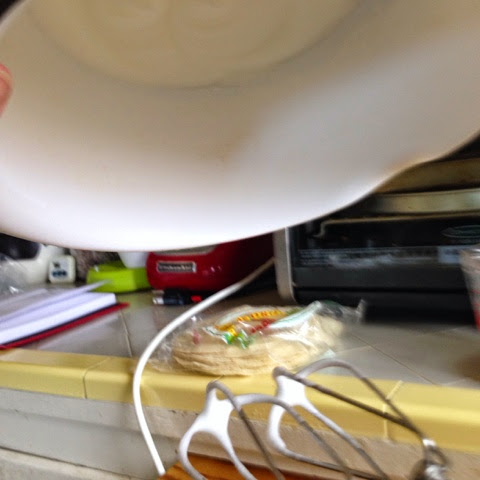
You are a GUI agent. You are given a task and a screenshot of the screen. Output one action in this format:
    pyautogui.click(x=<x>, y=<y>)
    Task: Click on the tile
    
    Given the screenshot: What is the action you would take?
    pyautogui.click(x=124, y=355)